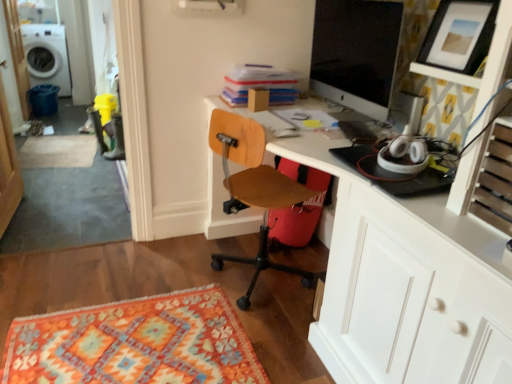
The height and width of the screenshot is (384, 512). I want to click on free space that is to the left of woodenchair at center, so [176, 260].